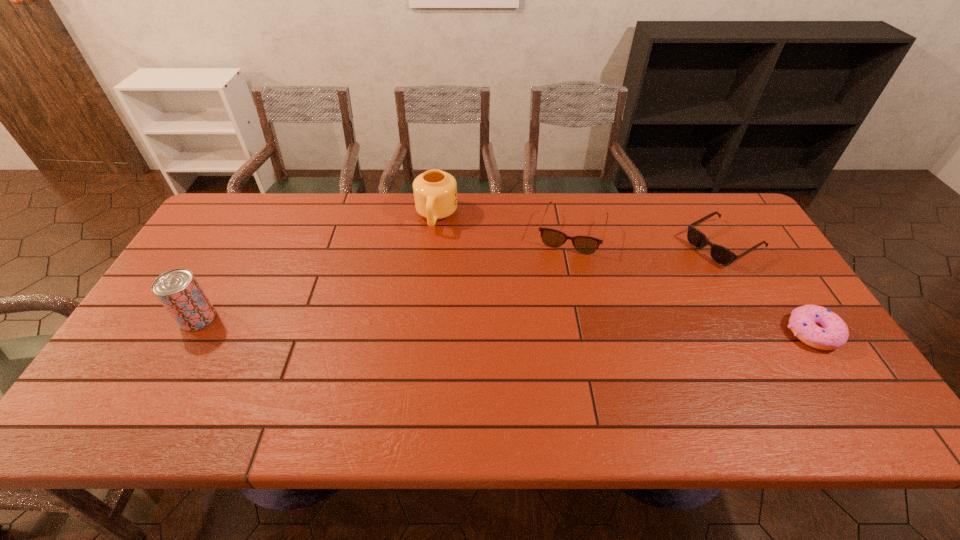
Locate which object is the second closest to the third object from right to left. Please provide its 2D coordinates. Your answer should be formatted as a tuple, i.e. [(x, y)], where the tuple contains the x and y coordinates of a point satisfying the conditions above.

[(435, 192)]

What are the coordinates of `free location that satisfies the following two spatial constraints: 1. on the back side of the beer can; 2. on the left side of the sunglasses` in the screenshot? It's located at (240, 244).

Locate an element on the screen. free space that satisfies the following two spatial constraints: 1. on the front side of the sunglasses; 2. on the left side of the mug is located at coordinates (433, 244).